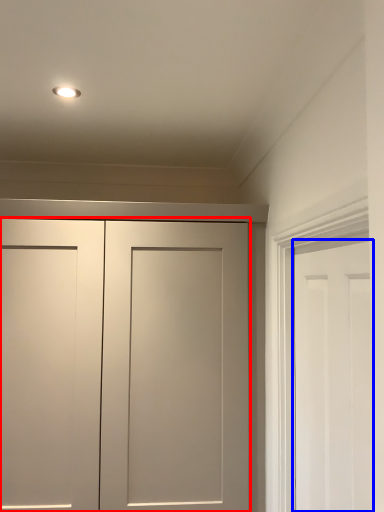
Question: Among these objects, which one is farthest to the camera, door (highlighted by a red box) or door (highlighted by a blue box)?

Choices:
 (A) door
 (B) door

Answer: (A)